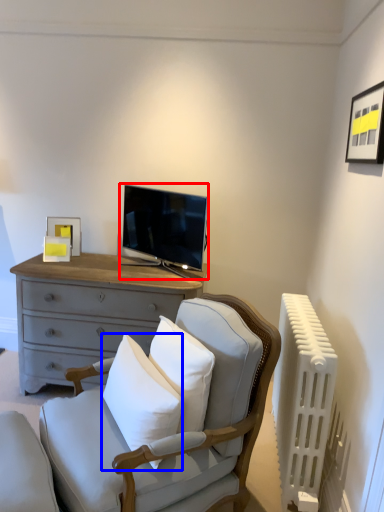
Question: Which object appears farthest to the camera in this image, television (highlighted by a red box) or pillow (highlighted by a blue box)?

Choices:
 (A) television
 (B) pillow

Answer: (A)